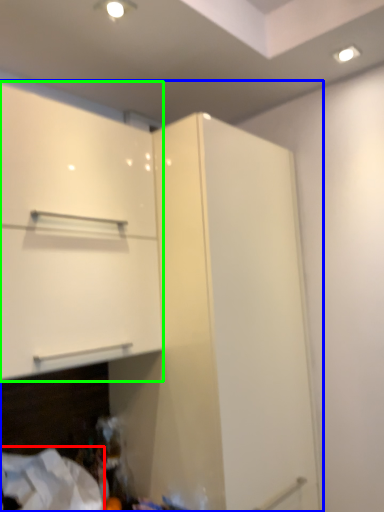
Question: Estimate the real-world distances between objects in this image. Which object is farther from sheet (highlighted by a red box), cupboard (highlighted by a blue box) or cabinetry (highlighted by a green box)?

Choices:
 (A) cupboard
 (B) cabinetry

Answer: (B)